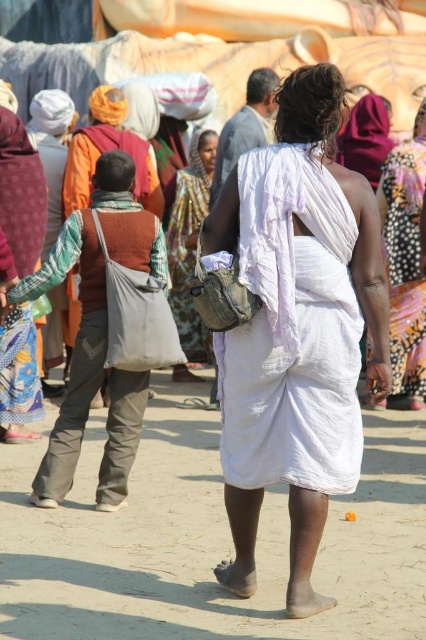
Which is below, white cotton sari at center or white cotton saree at center?

white cotton saree at center is below.

Does white cotton sari at center have a greater height compared to white cotton saree at center?

Yes, white cotton sari at center is taller than white cotton saree at center.

This screenshot has width=426, height=640. I want to click on white cotton sari at center, so click(x=296, y=328).

At what (x,y) coordinates should I click in order to perform the action: click on white cotton sari at center. Please return your answer as a coordinate pair (x, y). This screenshot has width=426, height=640. Looking at the image, I should click on (296, 328).

Does white cotton dhoti at center have a greater width compared to brown fabric bag at left?

In fact, white cotton dhoti at center might be narrower than brown fabric bag at left.

Locate an element on the screen. Image resolution: width=426 pixels, height=640 pixels. white cotton dhoti at center is located at coordinates (293, 332).

What do you see at coordinates (405, 260) in the screenshot? I see `white cotton saree at center` at bounding box center [405, 260].

Image resolution: width=426 pixels, height=640 pixels. Identify the location of white cotton saree at center. (405, 260).